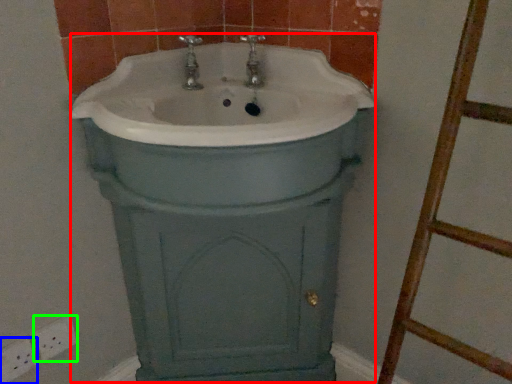
Question: Based on their relative distances, which object is farther from porcelain (highlighted by a red box)? Choose from electric outlet (highlighted by a blue box) and electric outlet (highlighted by a green box).

Choices:
 (A) electric outlet
 (B) electric outlet

Answer: (A)